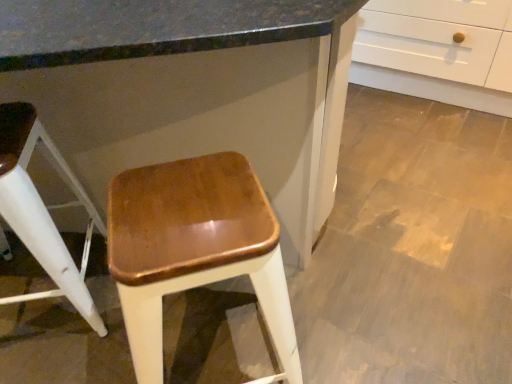
You are a GUI agent. You are given a task and a screenshot of the screen. Output one action in this format:
    pyautogui.click(x=<x>, y=<y>)
    Task: Click on the free space above glossy wood stool at center, which ranks as the 1th stool in right-to-left order (from a real-world perspective)
    
    Given the screenshot: What is the action you would take?
    pyautogui.click(x=185, y=208)